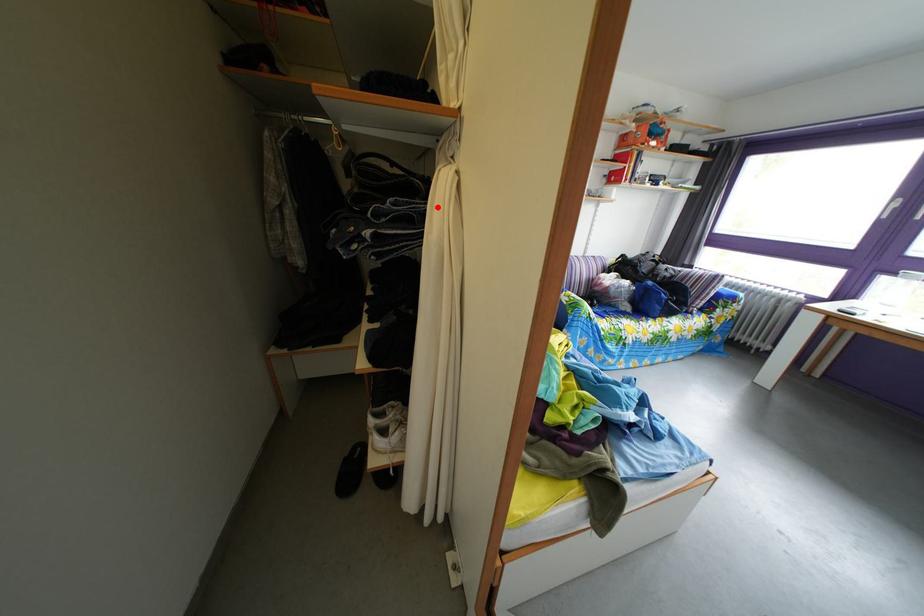
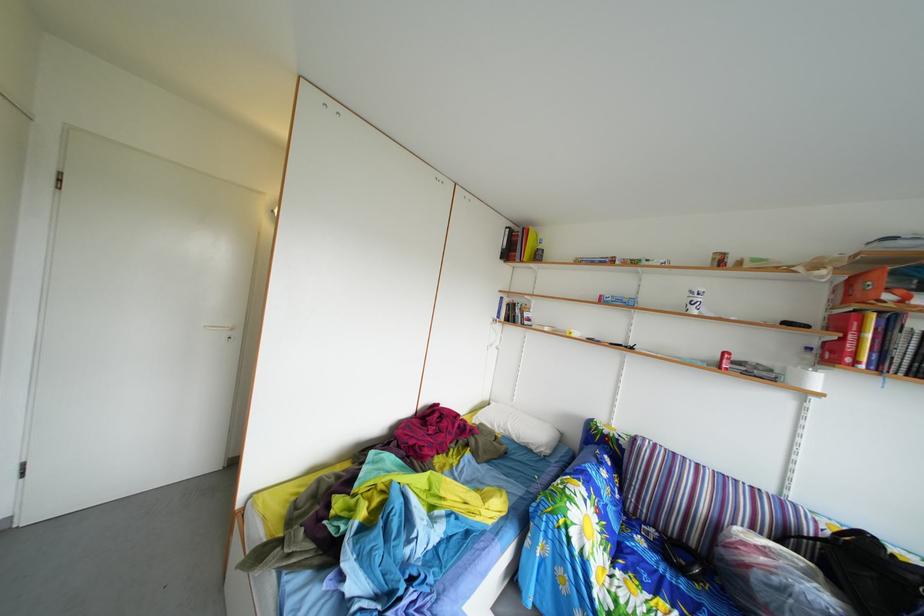
Question: I am providing you with two images of the same scene from different viewpoints. A red point is marked on the first image. Can you still see the location of the red point in image 2?

Choices:
 (A) Yes
 (B) No

Answer: (B)